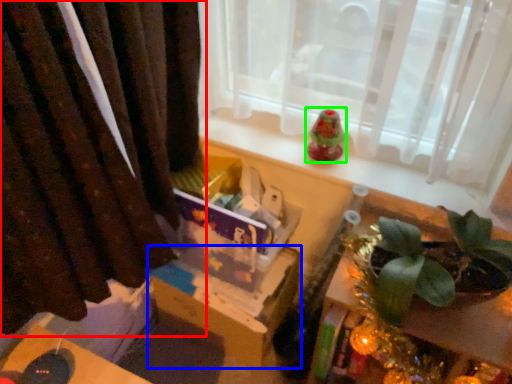
Question: Which object is the farthest from curtain (highlighted by a red box)? Choose among these: cardboard box (highlighted by a blue box) or toy (highlighted by a green box).

Choices:
 (A) cardboard box
 (B) toy

Answer: (B)